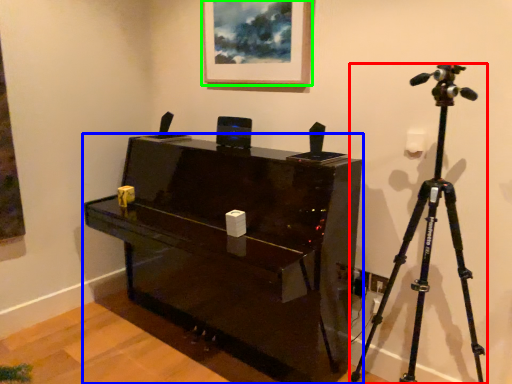
Question: Considering the real-world distances, which object is farthest from tripod (highlighted by a red box)? furniture (highlighted by a blue box) or picture frame (highlighted by a green box)?

Choices:
 (A) furniture
 (B) picture frame

Answer: (B)